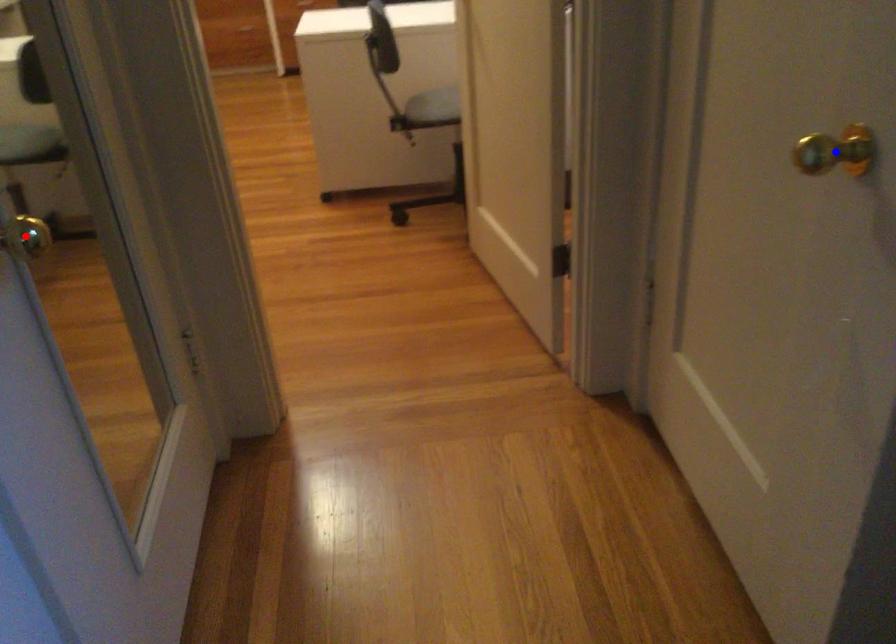
Question: In the image, two points are highlighted. Which point is nearer to the camera? Reply with the corresponding letter.

Choices:
 (A) blue point
 (B) red point

Answer: (A)